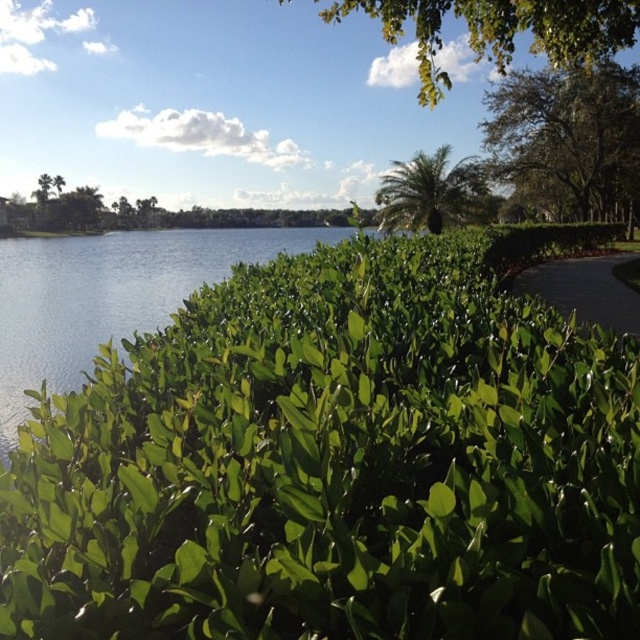
Question: Which point is farther to the camera?

Choices:
 (A) (397, 205)
 (B) (113, 332)
 (C) (600, 144)

Answer: (C)

Question: Which point is farther from the camera taking this photo?

Choices:
 (A) (534, 132)
 (B) (154, 380)

Answer: (A)

Question: Is green leafy tree at upper right below green leafy tree at upper center?

Choices:
 (A) yes
 (B) no

Answer: (A)

Question: Is green leafy hedge at center further to the viewer compared to green leafy bush at lower left?

Choices:
 (A) no
 (B) yes

Answer: (A)

Question: Considering the relative positions of green leafy bush at lower left and green leafy palm at upper right in the image provided, where is green leafy bush at lower left located with respect to green leafy palm at upper right?

Choices:
 (A) below
 (B) above

Answer: (B)

Question: Which object is farther from the camera taking this photo?

Choices:
 (A) green leafy palm at upper right
 (B) green leafy hedge at center
 (C) green leafy bush at lower left
 (D) green leafy tree at upper center

Answer: (A)